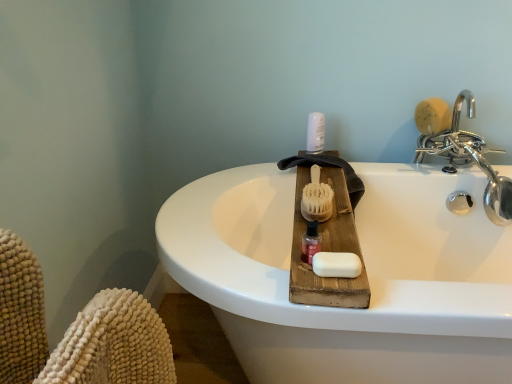
Question: From a real-world perspective, is wooden bristle brush at center, acting as the second brush starting from the right, above or below natural wood brush at upper right, marked as the 1th brush in a back-to-front arrangement?

Choices:
 (A) below
 (B) above

Answer: (A)

Question: Does point [304, 188] appear closer or farther from the camera than point [423, 102]?

Choices:
 (A) farther
 (B) closer

Answer: (B)

Question: Which is nearer to the wooden bristle brush at center, the 1th brush in the left-to-right sequence?

Choices:
 (A) pink glossy bottle at center
 (B) white plastic bottle at upper center
 (C) white matte soap at center
 (D) natural wood brush at upper right, positioned as the second brush in left-to-right order
 (E) chrome metallic faucet at upper right

Answer: (A)

Question: Based on their relative distances, which object is nearer to the white plastic bottle at upper center?

Choices:
 (A) natural wood brush at upper right, placed as the 2th brush when sorted from front to back
 (B) chrome metallic faucet at upper right
 (C) pink glossy bottle at center
 (D) wooden bristle brush at center, which is counted as the first brush, starting from the front
 (E) white matte soap at center

Answer: (D)